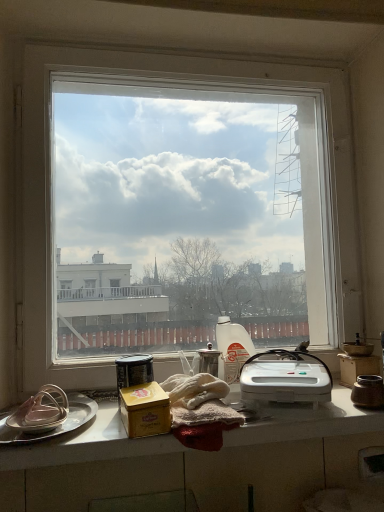
Question: Looking at the image, does brown ceramic jar at right, the 6th appliance positioned from the left, seem bigger or smaller compared to satin silver teapot at center, which is the fourth appliance in left-to-right order?

Choices:
 (A) small
 (B) big

Answer: (A)

Question: From a real-world perspective, is brown ceramic jar at right, the 6th appliance positioned from the left, physically located above or below satin silver teapot at center, which appears as the 3th appliance when viewed from the right?

Choices:
 (A) above
 (B) below

Answer: (B)

Question: Which is nearer to the white plastic bottle at center, the second appliance in the right-to-left sequence?

Choices:
 (A) satin silver teapot at center, which is the fourth appliance in left-to-right order
 (B) brown ceramic jar at right, the 6th appliance positioned from the left
 (C) white glossy countertop at lower center
 (D) gold matte tin at center, placed as the fourth appliance when sorted from right to left
 (E) silver metallic platter at left

Answer: (A)

Question: Estimate the real-world distances between objects in this image. Which object is farther from the transparent glass window at center?

Choices:
 (A) satin silver teapot at center, which appears as the 3th appliance when viewed from the right
 (B) matte silver lid at left, the sixth appliance when ordered from right to left
 (C) white plastic sandwich maker at center
 (D) metallic canister at center, marked as the second appliance in a left-to-right arrangement
 (E) gold matte tin at center, the 3th appliance in the left-to-right sequence

Answer: (E)